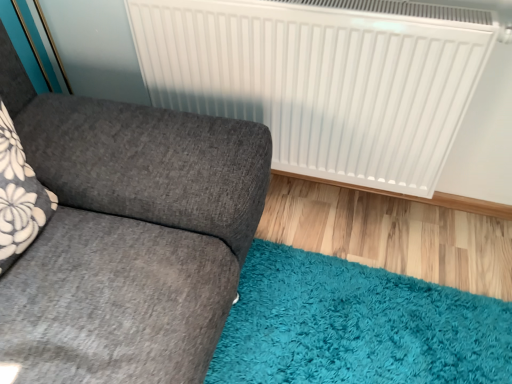
Describe the element at coordinates (128, 236) in the screenshot. I see `textured gray couch at left` at that location.

The image size is (512, 384). In order to click on textured gray couch at left in this screenshot , I will do `click(128, 236)`.

Find the location of a particular element. The image size is (512, 384). textured gray couch at left is located at coordinates (128, 236).